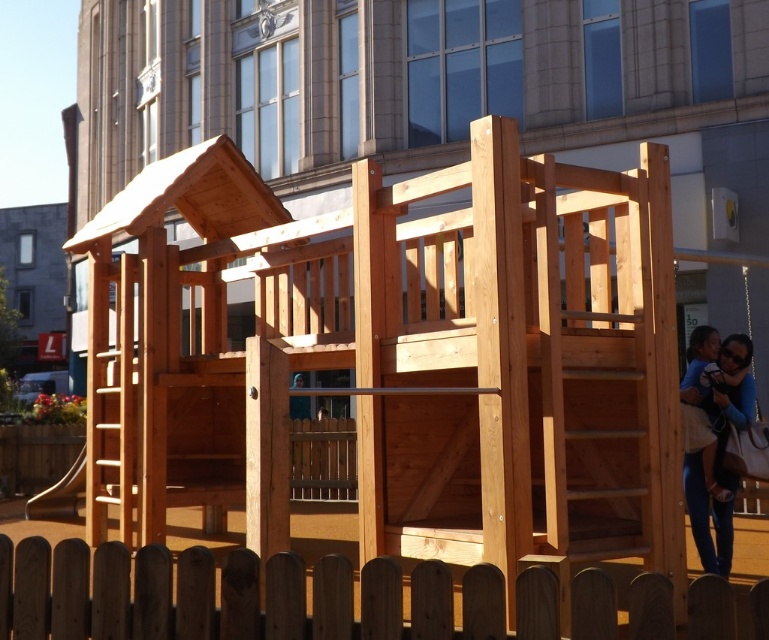
Does point (325, 618) come behind point (348, 426)?

That is False.

Which is above, brown wooden fence at lower center or brown wooden fence at center?

Positioned higher is brown wooden fence at lower center.

Between point (385, 595) and point (353, 422), which one is positioned in front?

Point (385, 595) is in front.

Where is `brown wooden fence at lower center`? This screenshot has height=640, width=769. brown wooden fence at lower center is located at coordinates (208, 595).

Does point (298, 568) lie behind point (68, 476)?

No, (298, 568) is closer to viewer.

Between point (325, 579) and point (77, 456), which one is positioned behind?

The point (77, 456) is more distant.

Between point (185, 627) and point (35, 499), which one is positioned in front?

Positioned in front is point (185, 627).

Image resolution: width=769 pixels, height=640 pixels. Identify the location of brown wooden fence at lower center. pyautogui.click(x=208, y=595).

Can you confirm if brown wooden fence at center is bigger than smooth brown slide at lower left?

No.

Is brown wooden fence at center to the left of smooth brown slide at lower left from the viewer's perspective?

No, brown wooden fence at center is not to the left of smooth brown slide at lower left.

Is point (355, 435) farther from camera compared to point (72, 486)?

Yes, point (355, 435) is farther from viewer.

Image resolution: width=769 pixels, height=640 pixels. What are the coordinates of `brown wooden fence at center` in the screenshot? It's located at (321, 460).